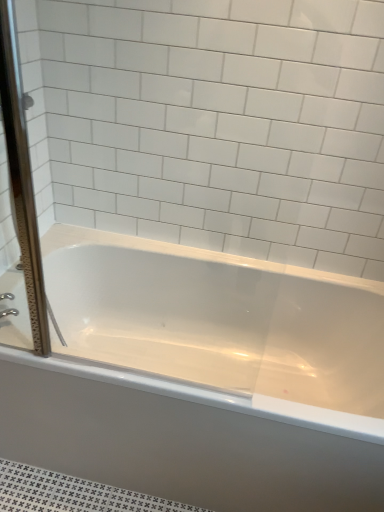
What do you see at coordinates (22, 178) in the screenshot? I see `clear glass screen door at left` at bounding box center [22, 178].

At what (x,y) coordinates should I click in order to perform the action: click on silver metallic faucet at left. Please return your answer as a coordinate pair (x, y). Looking at the image, I should click on (8, 312).

This screenshot has height=512, width=384. What are the coordinates of `white glossy bathtub at center` in the screenshot? It's located at (188, 439).

Does clear glass screen door at left have a larger size compared to white glossy bathtub at center?

Incorrect, clear glass screen door at left is not larger than white glossy bathtub at center.

Is clear glass screen door at left surrounding white glossy bathtub at center?

No, clear glass screen door at left does not contain white glossy bathtub at center.

From the image's perspective, is clear glass screen door at left under white glossy bathtub at center?

Actually, clear glass screen door at left appears above white glossy bathtub at center in the image.

From the image's perspective, which one is positioned higher, silver metallic faucet at left or clear glass screen door at left?

clear glass screen door at left is shown above in the image.

Does silver metallic faucet at left have a greater width compared to clear glass screen door at left?

Incorrect, the width of silver metallic faucet at left does not surpass that of clear glass screen door at left.

Would you say silver metallic faucet at left is to the left or to the right of clear glass screen door at left in the picture?

Clearly, silver metallic faucet at left is on the left of clear glass screen door at left in the image.

Is point (6, 309) closer to viewer compared to point (129, 376)?

No, it is not.

Who is smaller, silver metallic faucet at left or white glossy bathtub at center?

silver metallic faucet at left.

From a real-world perspective, which object rests below the other?

From a 3D spatial view, white glossy bathtub at center is below.

Which point is more distant from viewer, [46,307] or [1,318]?

The point [46,307] is more distant.

Is clear glass screen door at left oriented away from silver metallic faucet at left?

No, clear glass screen door at left is not facing the opposite direction of silver metallic faucet at left.

Can you tell me how much clear glass screen door at left and silver metallic faucet at left differ in facing direction?

The angle between the facing direction of clear glass screen door at left and the facing direction of silver metallic faucet at left is 122 degrees.

From a real-world perspective, which is physically below, clear glass screen door at left or silver metallic faucet at left?

From a 3D spatial view, silver metallic faucet at left is below.

Between white glossy bathtub at center and clear glass screen door at left, which one appears on the right side from the viewer's perspective?

white glossy bathtub at center.

Is white glossy bathtub at center beside clear glass screen door at left?

No, white glossy bathtub at center is not next to clear glass screen door at left.

From a real-world perspective, is white glossy bathtub at center located beneath clear glass screen door at left?

Yes, from a real-world perspective, white glossy bathtub at center is under clear glass screen door at left.

You are a GUI agent. You are given a task and a screenshot of the screen. Output one action in this format:
    pyautogui.click(x=<x>, y=<y>)
    Task: Click on the bathtub lying on the right of clear glass screen door at left
    The image size is (384, 512).
    Given the screenshot: What is the action you would take?
    pyautogui.click(x=188, y=439)

The height and width of the screenshot is (512, 384). I want to click on bathtub located below the silver metallic faucet at left (from the image's perspective), so click(x=188, y=439).

Who is shorter, white glossy bathtub at center or silver metallic faucet at left?

silver metallic faucet at left is shorter.

Can you confirm if white glossy bathtub at center is wider than silver metallic faucet at left?

Correct, the width of white glossy bathtub at center exceeds that of silver metallic faucet at left.

From a real-world perspective, is white glossy bathtub at center positioned above or below silver metallic faucet at left?

From a real-world perspective, white glossy bathtub at center is physically below silver metallic faucet at left.

Locate an element on the screen. The image size is (384, 512). bathtub to the right of clear glass screen door at left is located at coordinates (188, 439).

This screenshot has width=384, height=512. I want to click on faucet behind the clear glass screen door at left, so click(8, 312).

From the image, which object appears to be farther from silver metallic faucet at left, clear glass screen door at left or white glossy bathtub at center?

Based on the image, white glossy bathtub at center appears to be further to silver metallic faucet at left.

Estimate the real-world distances between objects in this image. Which object is further from clear glass screen door at left, silver metallic faucet at left or white glossy bathtub at center?

white glossy bathtub at center.

From the image, which object appears to be nearer to white glossy bathtub at center, silver metallic faucet at left or clear glass screen door at left?

clear glass screen door at left lies closer to white glossy bathtub at center than the other object.

Which object lies nearer to the anchor point silver metallic faucet at left, white glossy bathtub at center or clear glass screen door at left?

Among the two, clear glass screen door at left is located nearer to silver metallic faucet at left.

Based on their spatial positions, is white glossy bathtub at center or silver metallic faucet at left closer to clear glass screen door at left?

silver metallic faucet at left is positioned closer to the anchor clear glass screen door at left.

Estimate the real-world distances between objects in this image. Which object is further from white glossy bathtub at center, clear glass screen door at left or silver metallic faucet at left?

silver metallic faucet at left lies further to white glossy bathtub at center than the other object.

Where is `screen door between silver metallic faucet at left and white glossy bathtub at center`? screen door between silver metallic faucet at left and white glossy bathtub at center is located at coordinates (22, 178).